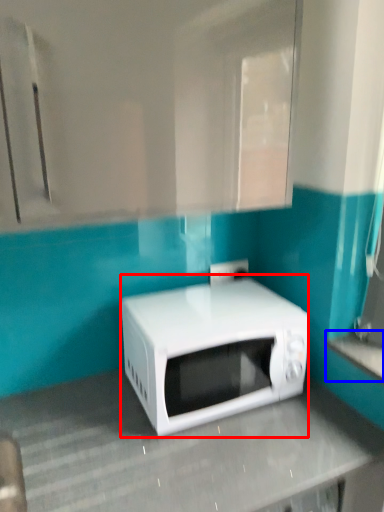
Question: Which object appears closest to the camera in this image, microwave oven (highlighted by a red box) or counter top (highlighted by a blue box)?

Choices:
 (A) microwave oven
 (B) counter top

Answer: (B)